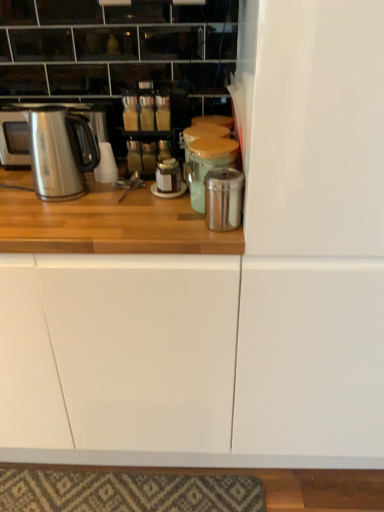
Image resolution: width=384 pixels, height=512 pixels. I want to click on free point above stainless steel kettle at left (from a real-world perspective), so click(x=50, y=103).